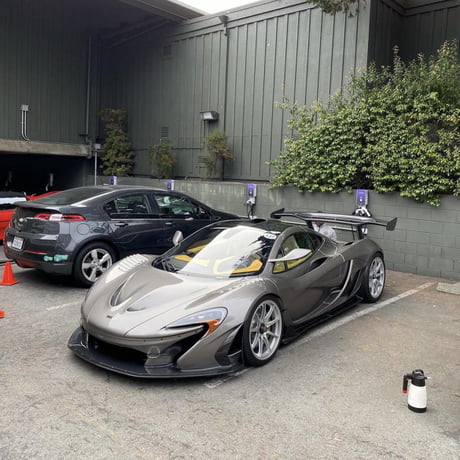
Where is `light`? light is located at coordinates (211, 118).